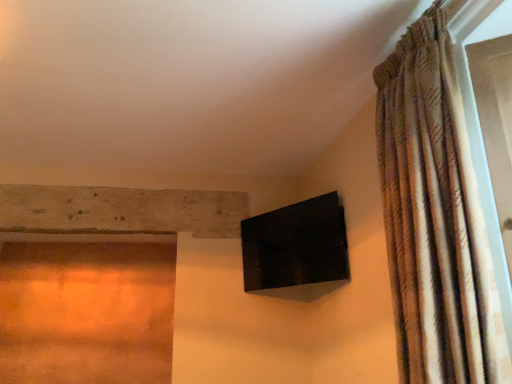
What do you see at coordinates (435, 217) in the screenshot?
I see `textured beige curtain at right` at bounding box center [435, 217].

This screenshot has width=512, height=384. I want to click on textured beige curtain at right, so click(435, 217).

Where is `textured beige curtain at right`? The height and width of the screenshot is (384, 512). textured beige curtain at right is located at coordinates (435, 217).